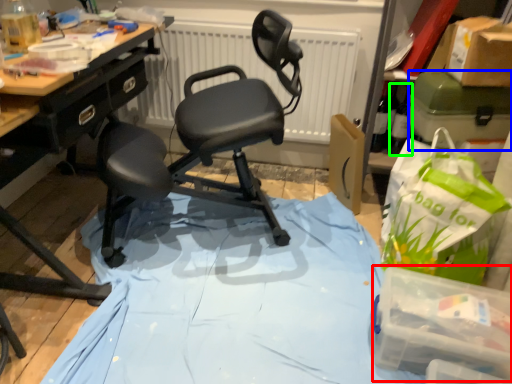
Question: Considering the real-world distances, which object is farthest from box (highlighted by a red box)? box (highlighted by a blue box) or bottle (highlighted by a green box)?

Choices:
 (A) box
 (B) bottle

Answer: (B)